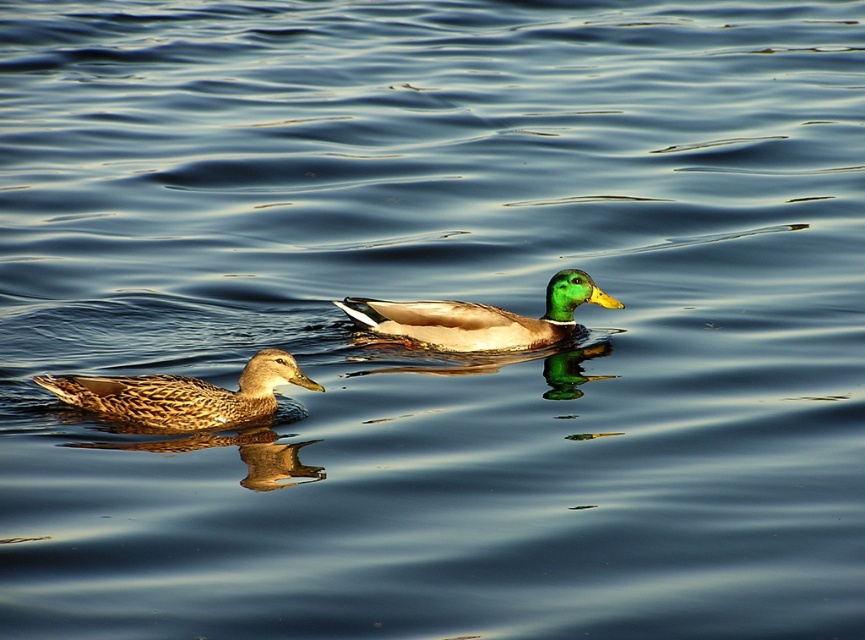
You are observing two ducks in a pond. You see the brown speckled feathers at left and the green glossy duck at center. Which duck is positioned lower in the image?

The brown speckled feathers at left is positioned below the green glossy duck at center, so it is lower in the image.

You are a wildlife photographer aiming to capture a closeup shot of both the brown speckled feathers at left and the green glossy duck at center in the same frame. Given that your camera has a maximum focus range of 3 feet, can you achieve this without moving your position?

The distance between the brown speckled feathers at left and the green glossy duck at center is 4.09 feet, which exceeds your camera maximum focus range of 3 feet. Therefore, you cannot capture both in the same frame without moving closer.

Based on the coordinates provided, where exactly is the brown speckled feathers at left located in the image?

The brown speckled feathers at left is located at the 2D coordinates point (183, 394).